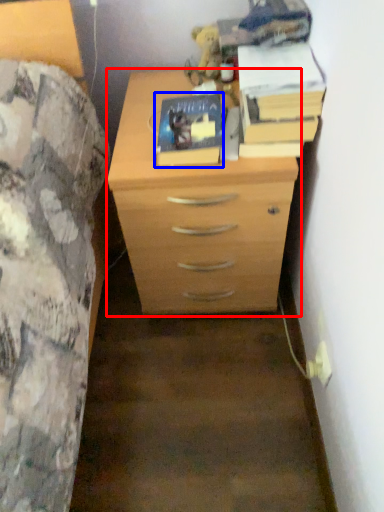
Question: Which object appears closest to the camera in this image, chest of drawers (highlighted by a red box) or paperback book (highlighted by a blue box)?

Choices:
 (A) chest of drawers
 (B) paperback book

Answer: (A)